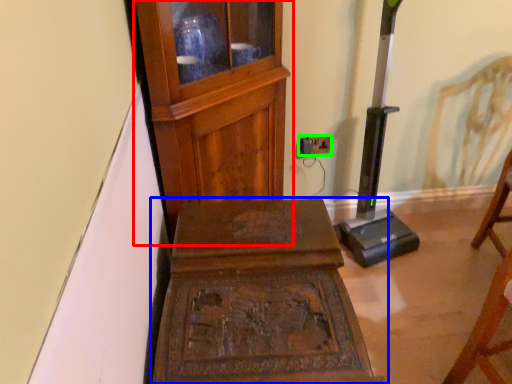
Question: Based on their relative distances, which object is nearer to furniture (highlighted by a red box)? Choose from furniture (highlighted by a blue box) and electric outlet (highlighted by a green box).

Choices:
 (A) furniture
 (B) electric outlet

Answer: (A)